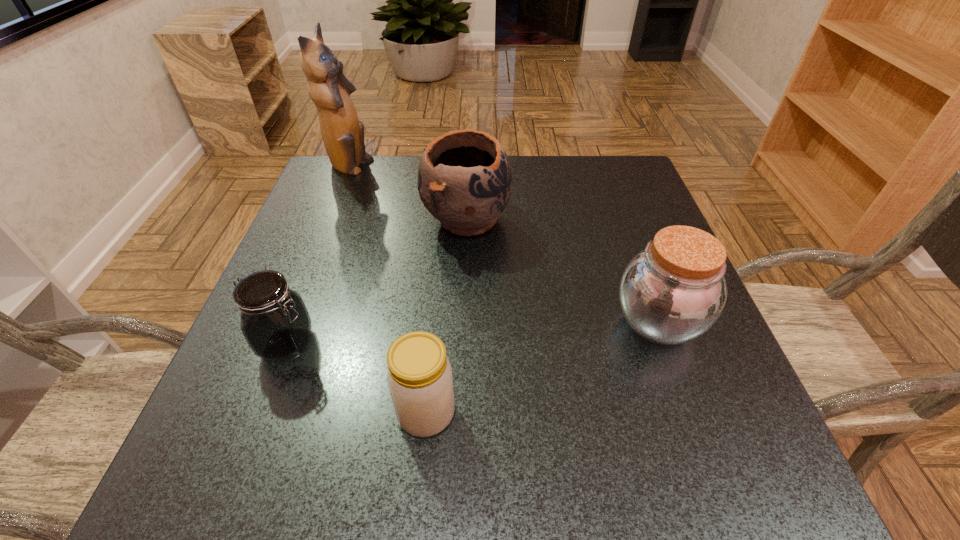
What are the coordinates of `blank space located 0.050m on the left of the tallest jar` in the screenshot? It's located at (584, 321).

The image size is (960, 540). I want to click on vacant region located 0.050m on the right of the nearest jar, so [x=489, y=413].

The height and width of the screenshot is (540, 960). In order to click on free space located on the lid of the leftmost jar in this screenshot , I will do `click(399, 344)`.

What are the coordinates of `cat situated at the far edge` in the screenshot? It's located at (343, 134).

Where is `pottery located in the far edge section of the desktop`? This screenshot has height=540, width=960. pottery located in the far edge section of the desktop is located at coordinates [464, 178].

Locate an element on the screen. object located in the near edge section of the desktop is located at coordinates (419, 375).

Where is `cat at the left edge`? cat at the left edge is located at coordinates (343, 134).

The width and height of the screenshot is (960, 540). Identify the location of jar present at the left edge. (275, 322).

Where is `object situated at the right edge`? Image resolution: width=960 pixels, height=540 pixels. object situated at the right edge is located at coordinates (672, 292).

Image resolution: width=960 pixels, height=540 pixels. Identify the location of object that is at the far left corner. (343, 134).